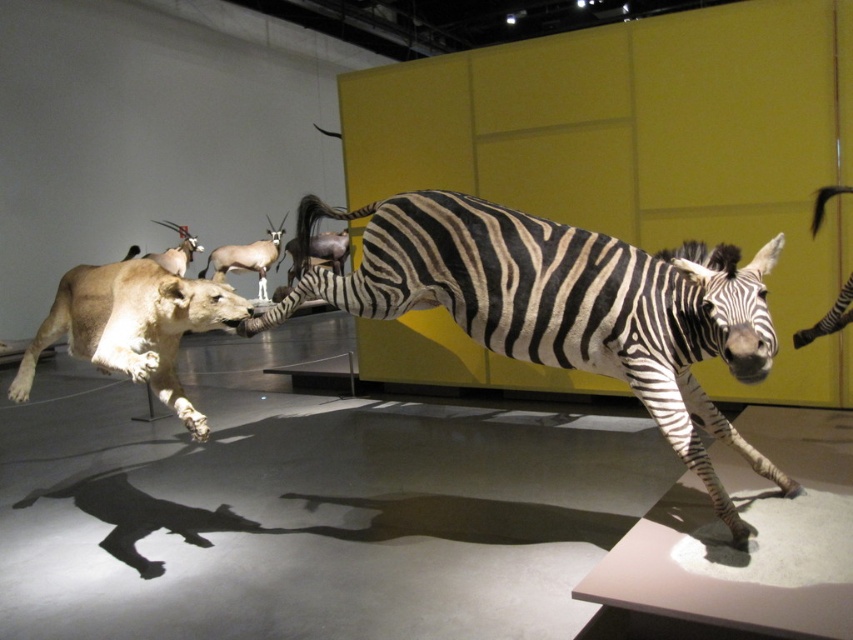
Looking at this image, who is lower down, black and white striped zebra at center or brown glossy antelope at center?

black and white striped zebra at center

Describe the element at coordinates (566, 307) in the screenshot. The width and height of the screenshot is (853, 640). I see `black and white striped zebra at center` at that location.

Which is behind, point (317, 276) or point (274, 243)?

Positioned behind is point (274, 243).

Image resolution: width=853 pixels, height=640 pixels. I want to click on black and white striped zebra at center, so click(x=566, y=307).

Can you confirm if black and white striped zebra at center is smaller than brown glossy antelope at upper left?

Incorrect, black and white striped zebra at center is not smaller in size than brown glossy antelope at upper left.

Does black and white striped zebra at center have a greater width compared to brown glossy antelope at upper left?

Indeed, black and white striped zebra at center has a greater width compared to brown glossy antelope at upper left.

Between point (589, 248) and point (173, 253), which one is positioned behind?

Positioned behind is point (173, 253).

I want to click on black and white striped zebra at center, so click(x=566, y=307).

Is point (57, 316) positioned after point (161, 224)?

That is False.

At what (x,y) coordinates should I click in order to perform the action: click on light brown fur lioness at left. Please return your answer as a coordinate pair (x, y). The height and width of the screenshot is (640, 853). Looking at the image, I should click on (132, 326).